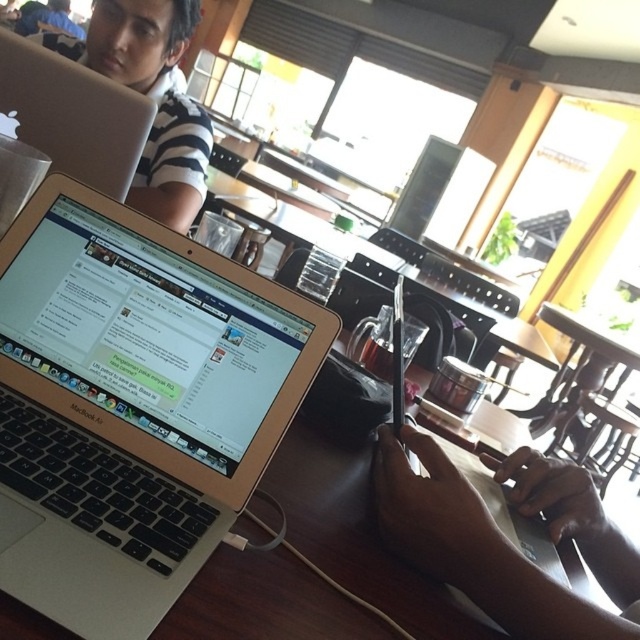
You are a barista trying to place a 15 cm wide coffee cup on the table. The silver metallic laptop at center and smooth skin hands at center are already on the table. Which object has more space available next to it to place the cup?

The silver metallic laptop at center is wider than the smooth skin hands at center, so placing the 15 cm wide coffee cup next to the smooth skin hands at center would have more space available.

You are a customer in the cafe and want to place your coffee mug between the silver metallic laptop at center and the silver metallic laptop at upper left. The coffee mug has a diameter of 10 inches. Will it fit in the space between them?

The silver metallic laptop at center is 13.05 inches away from the silver metallic laptop at upper left. Since the coffee mug has a diameter of 10 inches, it will fit in the space between them as the distance is greater than the mug size.

In the scene shown: In the scene of a casual cafe with a wooden table and a MacBook Air laptop at the center, there is a point marked at coordinates (132, 404). What object is located at this point?

The point at coordinates (132, 404) marks the location of the silver metallic laptop at center.